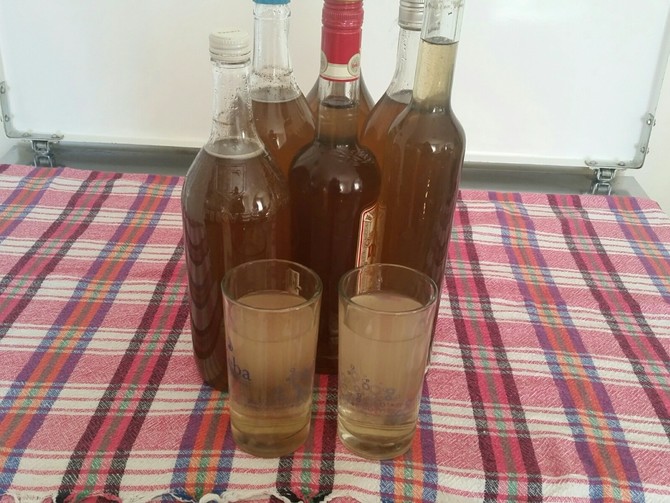
Find the location of a particular element. metal hinges is located at coordinates pyautogui.click(x=604, y=182), pyautogui.click(x=47, y=147).